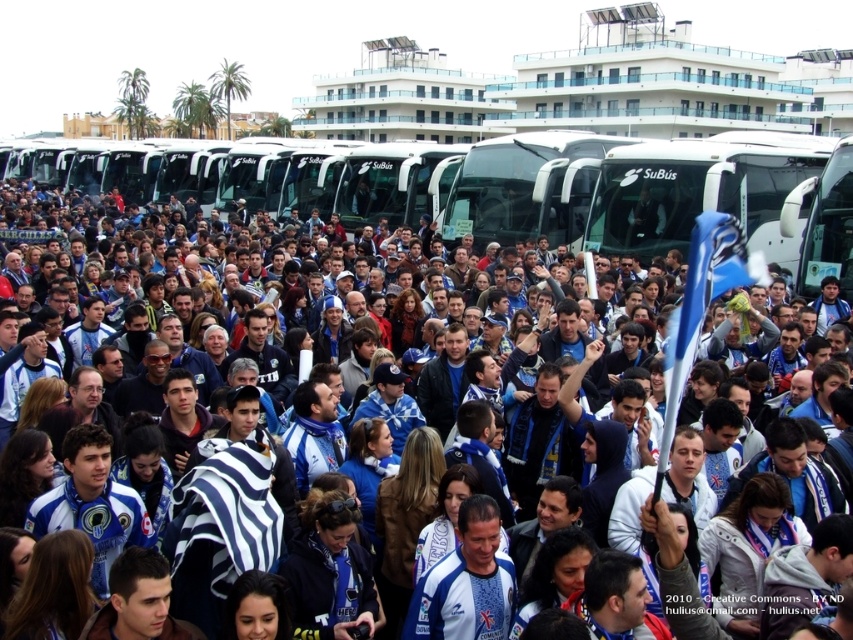
You are a photographer at the event and want to capture a photo of the white jersey at center and the white glossy tour bus at center. Since both are white, you need to adjust your camera settings to highlight their differences. Based on their positions, which object should you focus on first to ensure proper framing?

The white jersey at center should be focused on first because it is below the white glossy tour bus at center, so adjusting focus starting from the lower position will help in capturing both subjects effectively.

You are a photographer standing at the point with coordinates [123,440]. You want to take a photo of the crowd wearing blue and white attire. According to the scene, where are you positioned relative to the white jersey at center?

The point with coordinates [123,440] is on the white jersey at center, so you are positioned exactly on the white jersey at center.